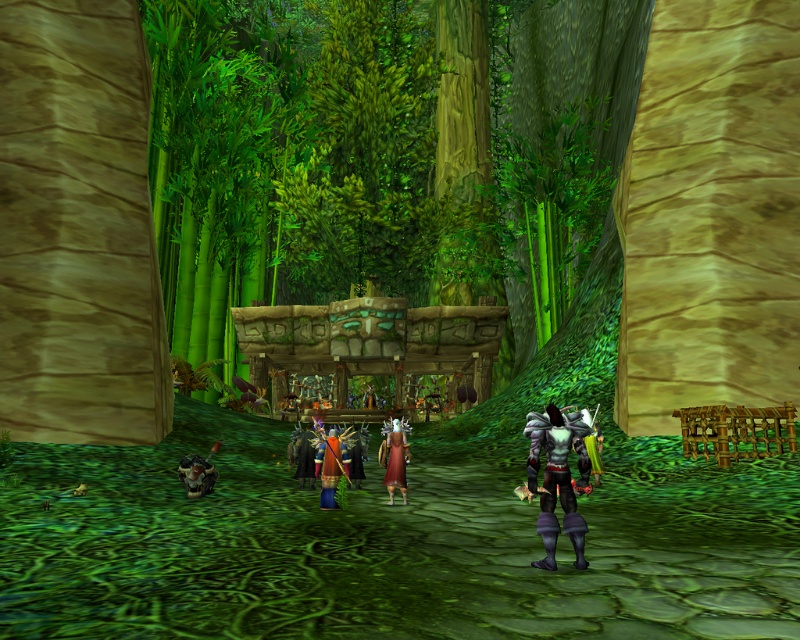
You are a character in a video game who needs to retrieve an item from the shiny blue armor at center. However, you are currently wearing the maroon velvet dress at center. Can you reach the armor without moving the dress?

The maroon velvet dress at center is in front of the shiny blue armor at center, so you can reach the armor by moving around the dress.

You are a character in the game who needs to quickly grab both the maroon velvet dress at center and the shiny blue armor at center. Can you reach both items without moving more than 3 feet from your current position?

The distance between the maroon velvet dress at center and the shiny blue armor at center is 34.99 inches, which is less than 3 feet. Therefore, you can reach both items without moving more than 3 feet from your current position.